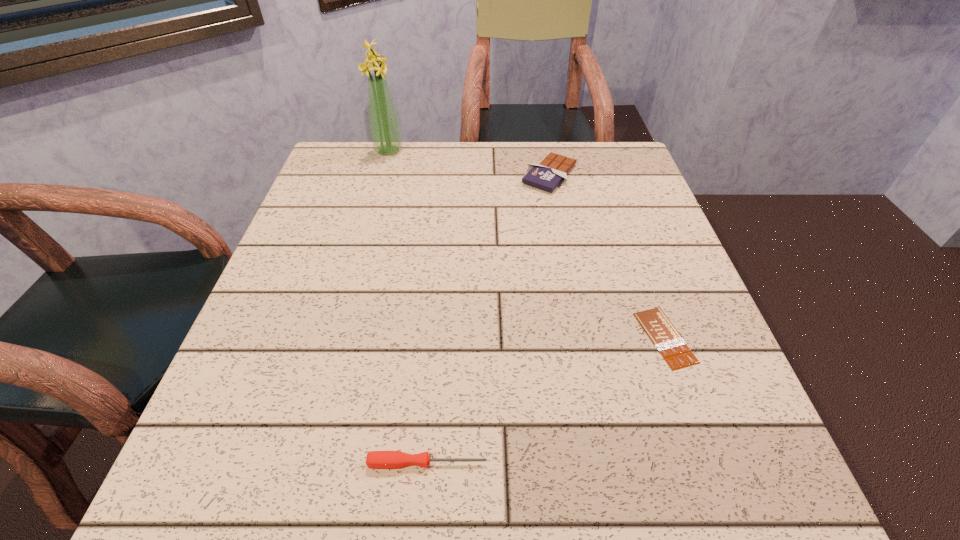
Where is `vacant space at the left edge of the desktop`? The height and width of the screenshot is (540, 960). vacant space at the left edge of the desktop is located at coordinates (350, 262).

In the image, there is a desktop. Identify the location of free space at the right edge. (671, 273).

Locate an element on the screen. vacant space at the far left corner is located at coordinates (x=341, y=193).

Where is `vacant position at the near left corner of the desktop`? This screenshot has width=960, height=540. vacant position at the near left corner of the desktop is located at coordinates (302, 471).

Where is `free region at the far right corner`? free region at the far right corner is located at coordinates (626, 153).

Identify the location of vacant space in between the taller chocolate bar and the tallest object. The height and width of the screenshot is (540, 960). (469, 163).

I want to click on free space between the nearer chocolate bar and the leftmost object, so click(527, 244).

This screenshot has height=540, width=960. I want to click on unoccupied position between the second object from right to left and the bouquet, so click(469, 163).

You are a GUI agent. You are given a task and a screenshot of the screen. Output one action in this format:
    pyautogui.click(x=<x>, y=<y>)
    Task: Click on the free space between the second nearest object and the second object from right to left
    
    Given the screenshot: What is the action you would take?
    [x=608, y=256]

The width and height of the screenshot is (960, 540). I want to click on free area in between the nearer chocolate bar and the tallest object, so click(x=527, y=244).